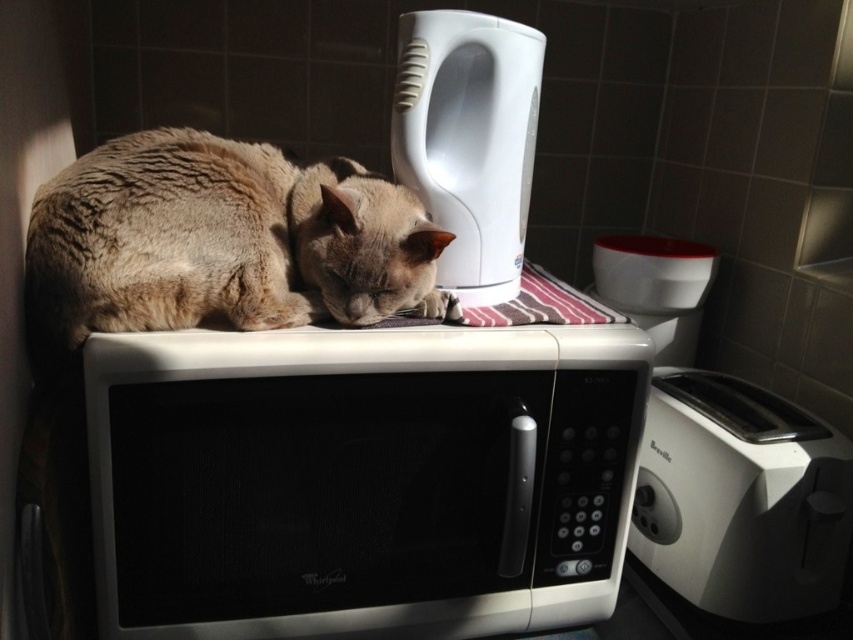
Question: Is white matte microwave at upper center smaller than fuzzy fur cat at upper left?

Choices:
 (A) no
 (B) yes

Answer: (A)

Question: Is white matte microwave at upper center thinner than white glossy electric kettle at upper right?

Choices:
 (A) yes
 (B) no

Answer: (B)

Question: Is white matte microwave at upper center further to the viewer compared to white plastic toaster at right?

Choices:
 (A) no
 (B) yes

Answer: (A)

Question: Which of these objects is positioned closest to the white glossy electric kettle at upper right?

Choices:
 (A) white plastic toaster at right
 (B) fuzzy fur cat at upper left
 (C) white matte microwave at upper center

Answer: (B)

Question: Which object appears farthest from the camera in this image?

Choices:
 (A) fuzzy fur cat at upper left
 (B) white plastic toaster at right

Answer: (B)

Question: Among these points, which one is nearest to the camera?

Choices:
 (A) (271, 280)
 (B) (763, 500)
 (C) (437, 541)

Answer: (A)